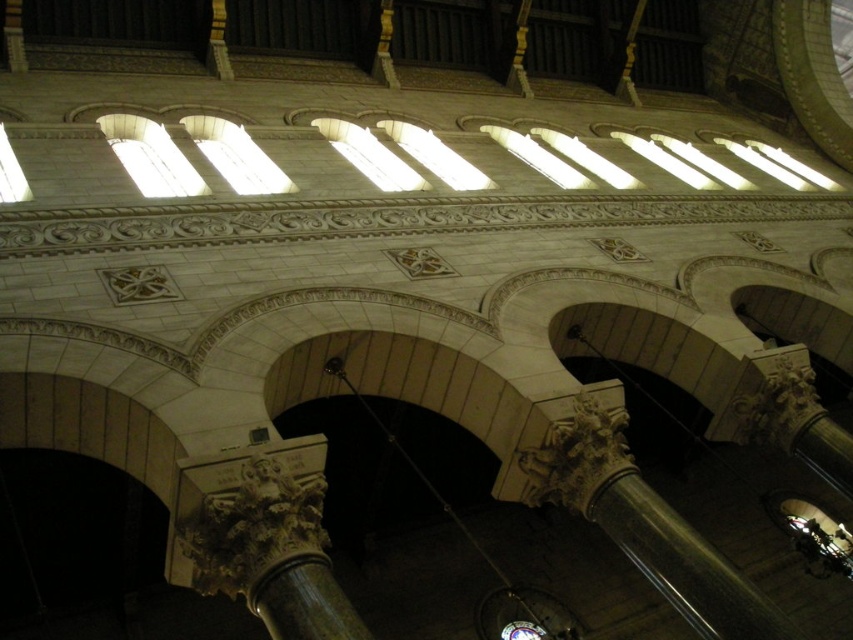
Can you confirm if carved stone column at center is positioned to the right of white glass window at upper center?

Correct, you'll find carved stone column at center to the right of white glass window at upper center.

Based on the photo, can you confirm if carved stone column at center is thinner than white glass window at upper center?

Yes, carved stone column at center is thinner than white glass window at upper center.

Does point (267, 554) come closer to viewer compared to point (260, 163)?

Yes.

Where is `carved stone column at center`? The image size is (853, 640). carved stone column at center is located at coordinates (264, 536).

From the picture: Between translucent glass window at upper center and clear glass windows at center, which one appears on the right side from the viewer's perspective?

Positioned to the right is clear glass windows at center.

Between point (112, 145) and point (457, 170), which one is positioned behind?

Point (457, 170)

The image size is (853, 640). I want to click on translucent glass window at upper center, so click(x=149, y=156).

Can you confirm if carved stone column at center is thinner than clear glass windows at center?

No, carved stone column at center is not thinner than clear glass windows at center.

Can you confirm if carved stone column at center is positioned to the right of clear glass windows at center?

No, carved stone column at center is not to the right of clear glass windows at center.

Who is more forward, (289, 634) or (451, 166)?

Point (289, 634) is more forward.

Find the location of a particular element. This screenshot has height=640, width=853. carved stone column at center is located at coordinates (264, 536).